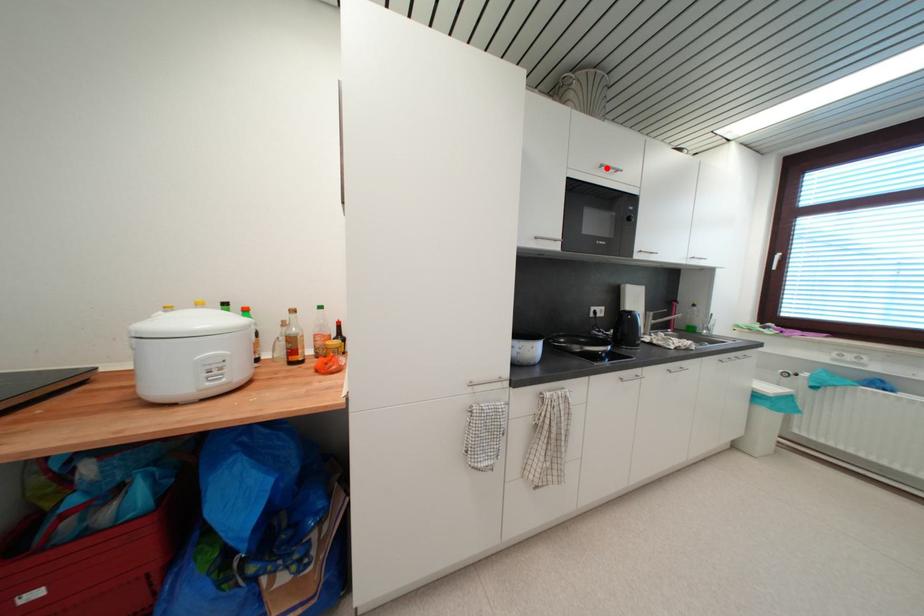
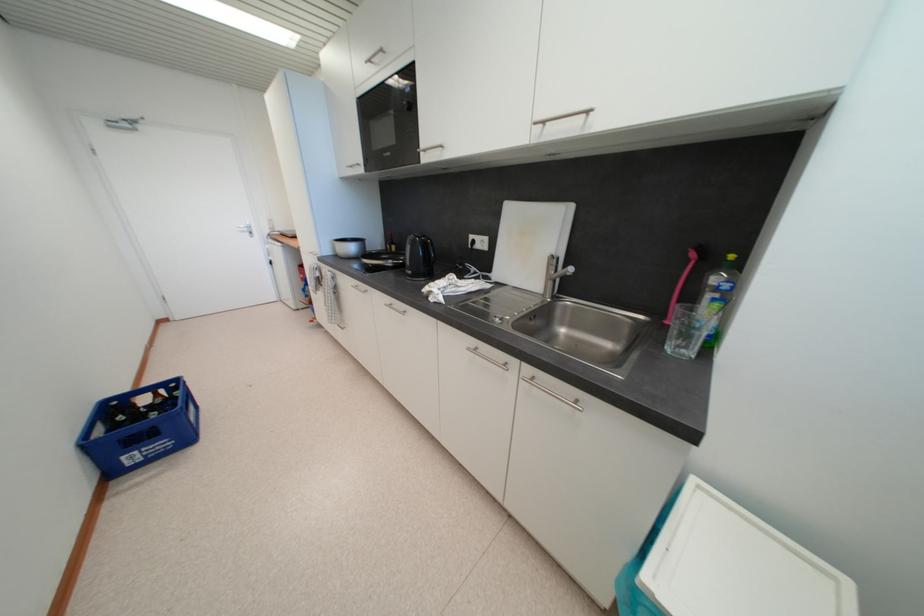
Question: I am providing you with two images of the same scene from different viewpoints. A red point is shown in image1. For the corresponding object point in image2, is it positioned nearer or farther from the camera?

Choices:
 (A) Nearer
 (B) Farther

Answer: (B)